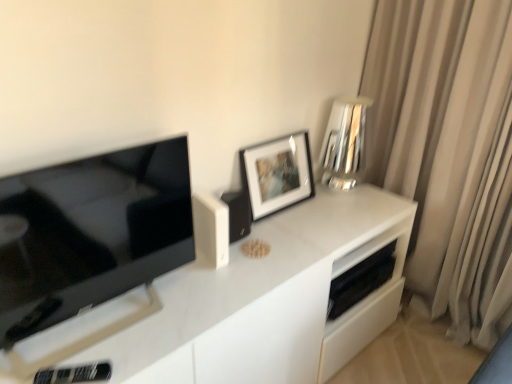
Question: Considering the relative positions of black matte speaker at upper center, which is counted as the 3th appliance, starting from the back, and black matte speaker at lower right, placed as the 1th appliance when sorted from back to front, in the image provided, is black matte speaker at upper center, which is counted as the 3th appliance, starting from the back, behind black matte speaker at lower right, placed as the 1th appliance when sorted from back to front,?

Choices:
 (A) no
 (B) yes

Answer: (A)

Question: Does black matte speaker at upper center, marked as the 3th appliance in a front-to-back arrangement, appear on the right side of black matte speaker at lower right, the fifth appliance in the front-to-back sequence?

Choices:
 (A) yes
 (B) no

Answer: (B)

Question: Considering the relative sizes of black matte speaker at upper center, marked as the 3th appliance in a front-to-back arrangement, and black matte speaker at lower right, placed as the 1th appliance when sorted from back to front, in the image provided, is black matte speaker at upper center, marked as the 3th appliance in a front-to-back arrangement, thinner than black matte speaker at lower right, placed as the 1th appliance when sorted from back to front,?

Choices:
 (A) yes
 (B) no

Answer: (A)

Question: Is black matte speaker at upper center, acting as the 3th appliance starting from the right, looking in the opposite direction of black matte speaker at lower right, which appears as the 1th appliance when viewed from the right?

Choices:
 (A) no
 (B) yes

Answer: (A)

Question: Is black matte speaker at upper center, which is counted as the 3th appliance, starting from the back, wider than black matte speaker at lower right, marked as the 5th appliance in a left-to-right arrangement?

Choices:
 (A) yes
 (B) no

Answer: (B)

Question: From the image's perspective, is black matte speaker at upper center, the third appliance in the left-to-right sequence, under black matte speaker at lower right, which appears as the 1th appliance when viewed from the right?

Choices:
 (A) no
 (B) yes

Answer: (A)

Question: Is silver reflective vase at upper right, the 2th appliance viewed from the back, behind beige fabric curtain at right?

Choices:
 (A) yes
 (B) no

Answer: (A)

Question: From the image's perspective, is silver reflective vase at upper right, which is the fourth appliance from left to right, below beige fabric curtain at right?

Choices:
 (A) yes
 (B) no

Answer: (B)

Question: Is silver reflective vase at upper right, which is the fourth appliance from left to right, surrounding beige fabric curtain at right?

Choices:
 (A) yes
 (B) no

Answer: (B)

Question: Does silver reflective vase at upper right, the 2th appliance viewed from the back, have a smaller size compared to beige fabric curtain at right?

Choices:
 (A) no
 (B) yes

Answer: (B)

Question: Does silver reflective vase at upper right, which is counted as the 4th appliance, starting from the front, appear on the right side of beige fabric curtain at right?

Choices:
 (A) no
 (B) yes

Answer: (A)

Question: Does silver reflective vase at upper right, which is counted as the 4th appliance, starting from the front, turn towards beige fabric curtain at right?

Choices:
 (A) yes
 (B) no

Answer: (B)

Question: Is white matte speaker at center, arranged as the 2th appliance when viewed from the left, bigger than black matte speaker at upper center, acting as the 3th appliance starting from the right?

Choices:
 (A) yes
 (B) no

Answer: (B)